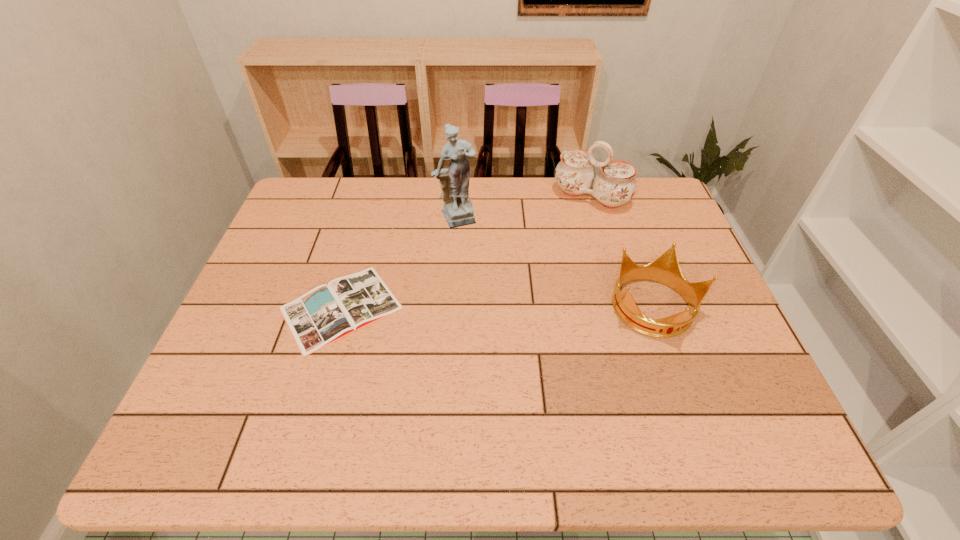
Identify the location of vacant region at the far edge of the desktop. (368, 216).

In the image, there is a desktop. Identify the location of vacant space at the left edge. The width and height of the screenshot is (960, 540). (237, 330).

You are a GUI agent. You are given a task and a screenshot of the screen. Output one action in this format:
    pyautogui.click(x=<x>, y=<y>)
    Task: Click on the free spot at the right edge of the desktop
    Image resolution: width=960 pixels, height=540 pixels.
    Given the screenshot: What is the action you would take?
    pyautogui.click(x=703, y=312)

The width and height of the screenshot is (960, 540). In the image, there is a desktop. Identify the location of free space at the far right corner. (674, 214).

Where is `unoccupied position between the book and the tallest object`? unoccupied position between the book and the tallest object is located at coordinates tap(399, 263).

I want to click on empty space between the shortest object and the tallest object, so click(399, 263).

This screenshot has height=540, width=960. I want to click on vacant space that's between the figurine and the leftmost object, so click(x=399, y=263).

Locate an element on the screen. free space between the second object from left to right and the book is located at coordinates (399, 263).

Identify the location of free space that is in between the tallest object and the third shortest object. (524, 208).

Find the location of a particular element. The height and width of the screenshot is (540, 960). free area in between the third tallest object and the book is located at coordinates (498, 308).